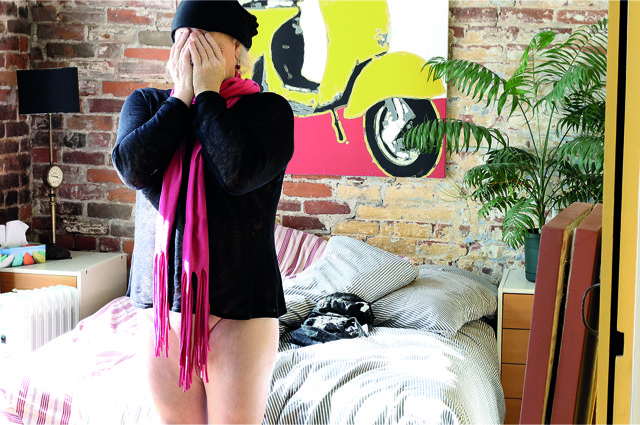
The width and height of the screenshot is (640, 425). What are the coordinates of `plant pot` in the screenshot? It's located at (532, 251).